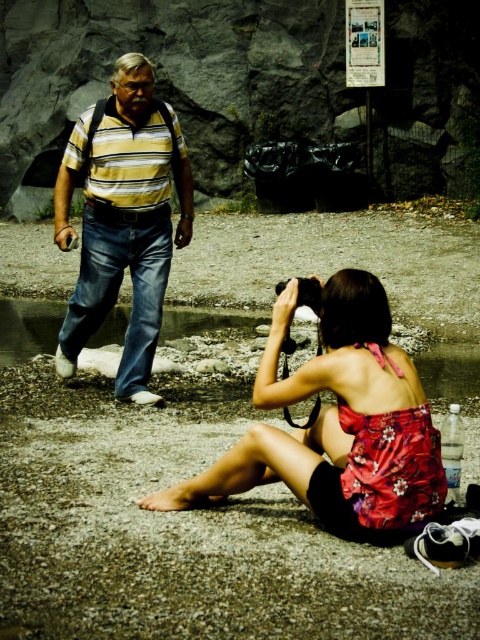
Is floral fabric bikini top at lower center thinner than black plastic camera at center?

Incorrect, floral fabric bikini top at lower center's width is not less than black plastic camera at center's.

I want to click on floral fabric bikini top at lower center, so click(392, 467).

At what (x,y) coordinates should I click in order to perform the action: click on floral fabric bikini top at lower center. Please return your answer as a coordinate pair (x, y). This screenshot has height=640, width=480. Looking at the image, I should click on (392, 467).

Is floral fabric dress at center below striped cotton shirt at left?

Correct, floral fabric dress at center is located below striped cotton shirt at left.

Does floral fabric dress at center come behind striped cotton shirt at left?

That is False.

Locate an element on the screen. This screenshot has height=640, width=480. floral fabric dress at center is located at coordinates (337, 426).

Does striped cotton shirt at left have a lesser width compared to black plastic camera at center?

No.

Who is lower down, striped cotton shirt at left or black plastic camera at center?

black plastic camera at center is below.

Between point (162, 138) and point (300, 296), which one is positioned in front?

Point (300, 296)

Identify the location of striped cotton shirt at left. (122, 220).